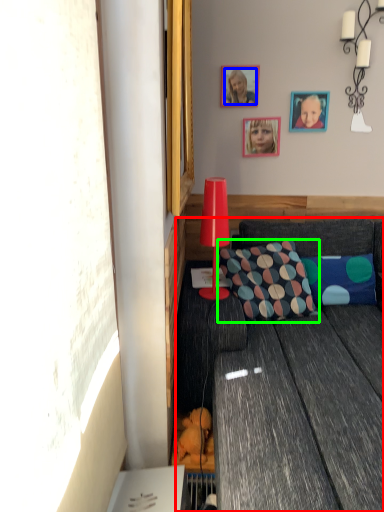
Question: Based on their relative distances, which object is nearer to studio couch (highlighted by a red box)? Choose from person (highlighted by a blue box) and pillow (highlighted by a green box).

Choices:
 (A) person
 (B) pillow

Answer: (B)